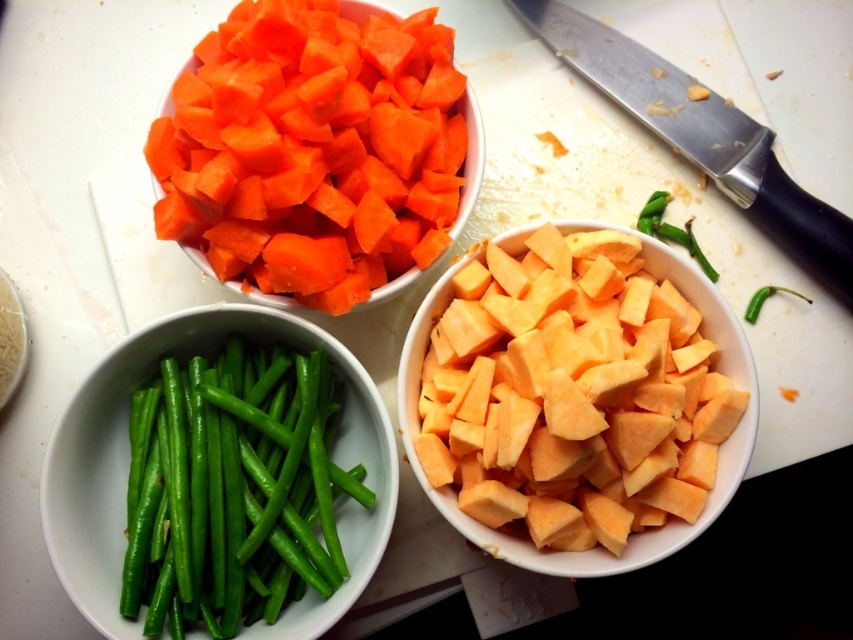
This screenshot has height=640, width=853. What do you see at coordinates (233, 490) in the screenshot? I see `green smooth beans at center` at bounding box center [233, 490].

Does point (192, 508) come in front of point (761, 304)?

Yes, it is in front of point (761, 304).

The image size is (853, 640). Find the location of `green smooth beans at center`. green smooth beans at center is located at coordinates (233, 490).

Is orange matte carrot at upper left shorter than silver metallic knife at upper right?

Correct, orange matte carrot at upper left is not as tall as silver metallic knife at upper right.

Find the location of `orange matte carrot at upper left`. orange matte carrot at upper left is located at coordinates (318, 156).

Who is more distant from viewer, (350, 266) or (689, 106)?

Positioned behind is point (689, 106).

Locate an element on the screen. This screenshot has width=853, height=640. orange matte carrot at upper left is located at coordinates (318, 156).

Is point (325, 102) farther from viewer compared to point (300, 401)?

No, it is in front of (300, 401).

Is orange matte carrot at upper left smaller than green smooth beans at center?

Actually, orange matte carrot at upper left might be larger than green smooth beans at center.

Identify the location of orange matte carrot at upper left. 318,156.

Identify the location of orange matte carrot at upper left. (318, 156).